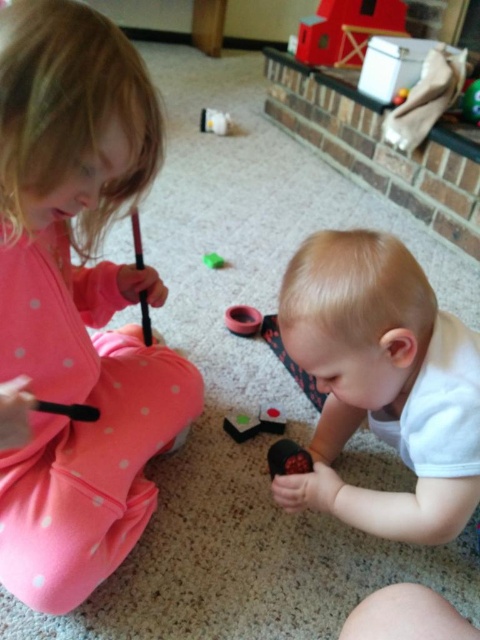
From the picture: You are a parent trying to locate two points in the image. The first point is at coordinates point (388, 518) and the second is at point (206, 264). Which point is nearer to you?

Point (388, 518) is closer to the viewer than point (206, 264).

There is a rubber ring at center. Two children are playing with black objects. How far apart are the two children?

The two children are 5.22 feet apart.